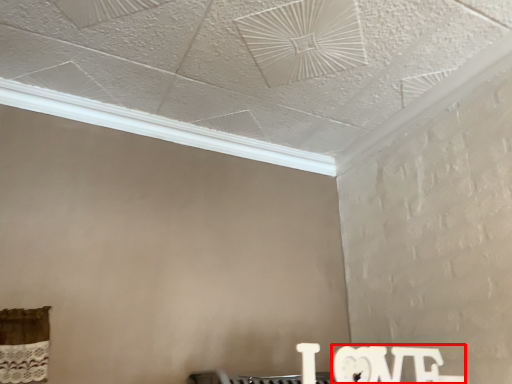
Question: Where is writing (annotated by the red box) located in relation to window in the image?

Choices:
 (A) left
 (B) right

Answer: (B)